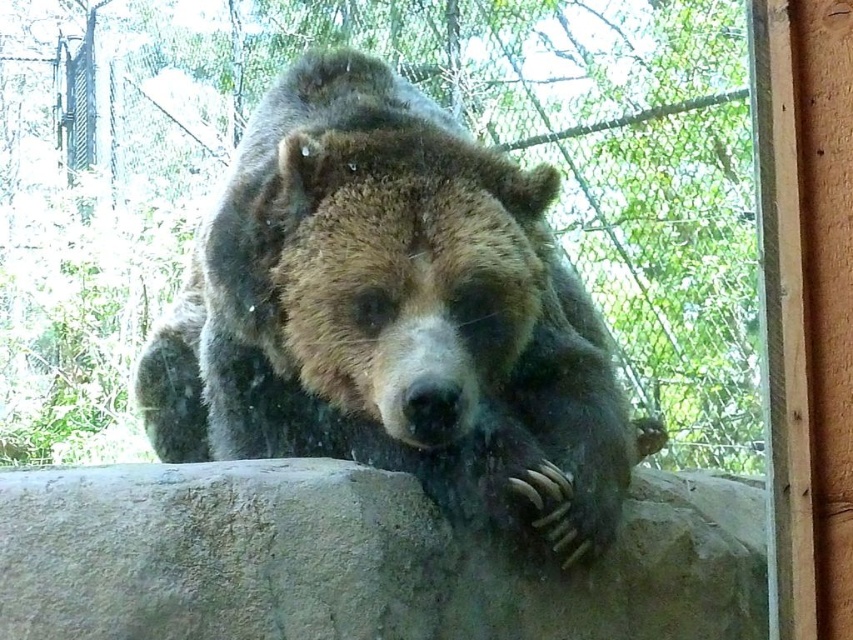
In the scene shown: You are a wildlife photographer trying to capture a photo of the fuzzy brown bear at center and the gray rough boulder at center. Which object is taller when viewed from the front?

The fuzzy brown bear at center is taller than the gray rough boulder at center.

You are a zookeeper who needs to place a new feeding bowl for the fuzzy brown bear at center. The bowl requires a stable surface at least 18 inches away from the bear to ensure safety. Is the gray rough boulder at center a suitable surface for placing the bowl?

The distance between the fuzzy brown bear at center and the gray rough boulder at center is 16.77 inches, which is less than the required 18 inches. Therefore, the gray rough boulder at center is not a suitable surface for placing the feeding bowl as it does not meet the safety distance requirement.

You are a zookeeper observing the enclosure. You need to place a new feeding tray on the gray rough boulder at center. However, the fuzzy brown bear at center is currently resting there. Can you safely place the tray without disturbing the bear?

The fuzzy brown bear at center is above the gray rough boulder at center, meaning the bear is on top of the boulder. Therefore, you cannot place the feeding tray there without moving the bear first.